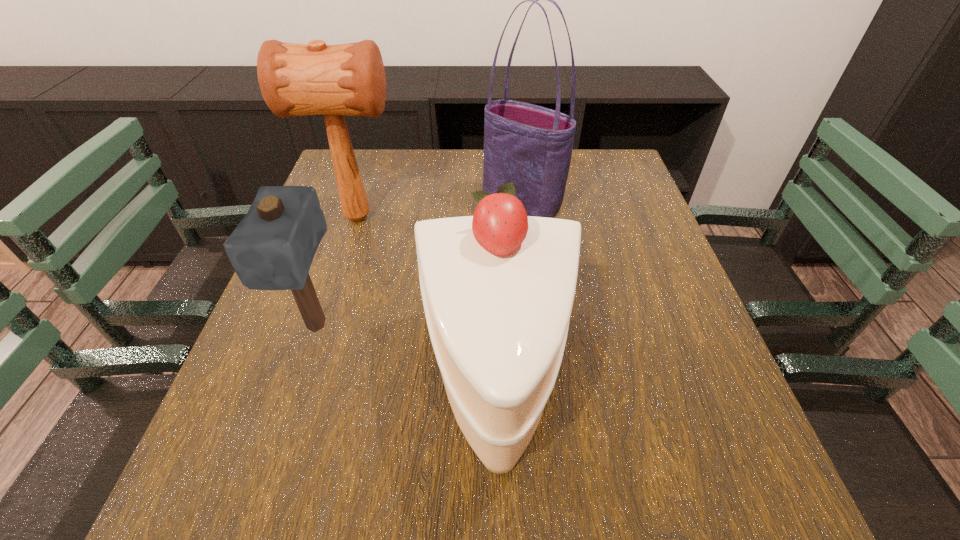
Where is `unoccupied area between the nearer mallet and the taller mallet`? This screenshot has width=960, height=540. unoccupied area between the nearer mallet and the taller mallet is located at coordinates (337, 272).

Find the location of a particular element. This screenshot has height=540, width=960. the second closest object to the farther mallet is located at coordinates (272, 248).

Locate an element on the screen. The height and width of the screenshot is (540, 960). object that is the third closest to the taller mallet is located at coordinates (498, 287).

This screenshot has width=960, height=540. In order to click on vacant space that satisfies the following two spatial constraints: 1. on the strike surface of the cake; 2. on the right side of the farther mallet in this screenshot , I will do `click(305, 383)`.

The width and height of the screenshot is (960, 540). In order to click on vacant position in the image that satisfies the following two spatial constraints: 1. on the strike surface of the taller mallet; 2. on the left side of the cake in this screenshot , I will do `click(305, 383)`.

Where is `free point that satisfies the following two spatial constraints: 1. on the back side of the tote bag; 2. on the right side of the cake`? Image resolution: width=960 pixels, height=540 pixels. free point that satisfies the following two spatial constraints: 1. on the back side of the tote bag; 2. on the right side of the cake is located at coordinates (492, 203).

Locate an element on the screen. free space that satisfies the following two spatial constraints: 1. on the strike surface of the taller mallet; 2. on the left side of the cake is located at coordinates coord(305,383).

What are the coordinates of `free space that satisfies the following two spatial constraints: 1. on the strike surface of the cake; 2. on the left side of the taller mallet` in the screenshot? It's located at (305, 383).

The height and width of the screenshot is (540, 960). Find the location of `free spot that satisfies the following two spatial constraints: 1. on the strike surface of the taller mallet; 2. on the back side of the cake`. free spot that satisfies the following two spatial constraints: 1. on the strike surface of the taller mallet; 2. on the back side of the cake is located at coordinates (305, 383).

Locate an element on the screen. This screenshot has height=540, width=960. vacant position in the image that satisfies the following two spatial constraints: 1. on the strike surface of the taller mallet; 2. on the back side of the cake is located at coordinates (305, 383).